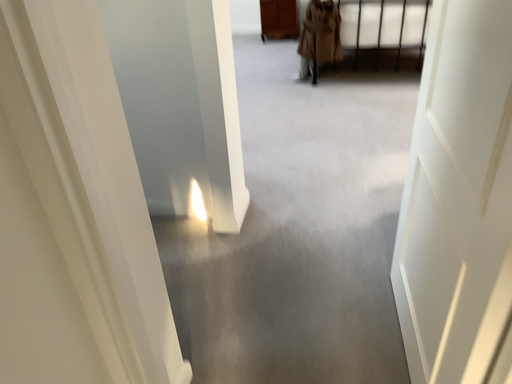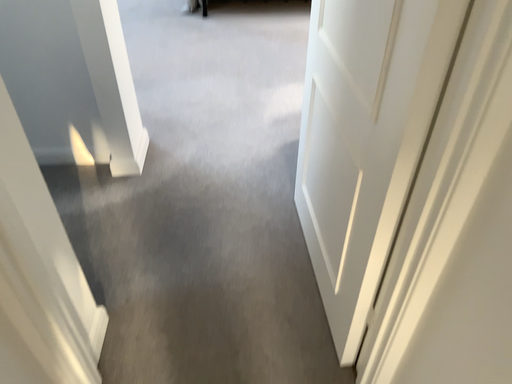
Question: Which way did the camera rotate in the video?

Choices:
 (A) rotated right
 (B) rotated left

Answer: (A)